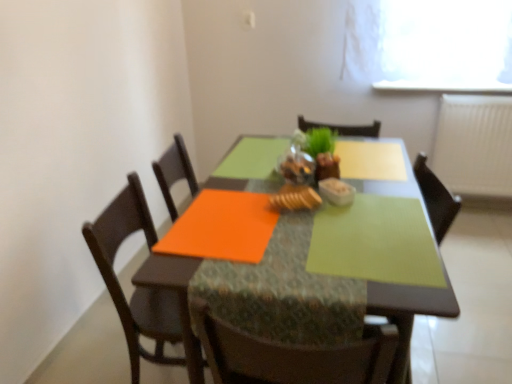
You are a GUI agent. You are given a task and a screenshot of the screen. Output one action in this format:
    pyautogui.click(x=<x>, y=<y>)
    Task: Click on the vacant space to the left of green matte placemat at center
    
    Given the screenshot: What is the action you would take?
    pyautogui.click(x=270, y=252)